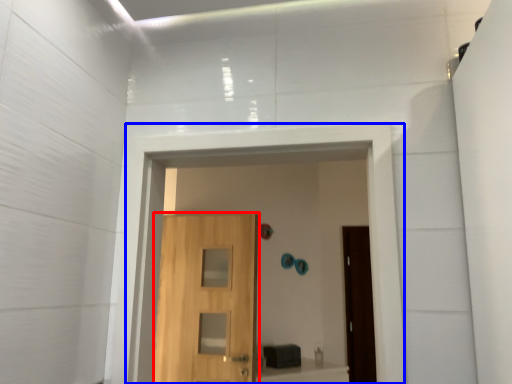
Question: Which object is closer to the camera taking this photo, door (highlighted by a red box) or passage (highlighted by a blue box)?

Choices:
 (A) door
 (B) passage

Answer: (B)